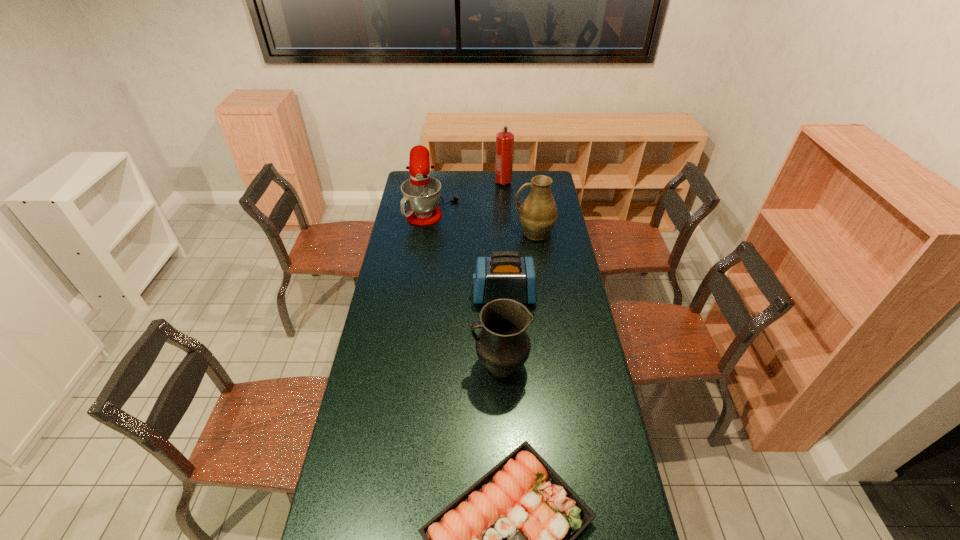
This screenshot has height=540, width=960. Identify the location of the third closest object to the mixer. (505, 274).

This screenshot has height=540, width=960. I want to click on vacant space that satisfies the following two spatial constraints: 1. on the handle side the fire extinguisher; 2. on the handle side of the second nearest object, so click(x=516, y=366).

Locate an element on the screen. free location that satisfies the following two spatial constraints: 1. on the handle side of the farther pitcher; 2. on the handle side the fire extinguisher is located at coordinates (527, 183).

This screenshot has height=540, width=960. Find the location of `free space that satisfies the following two spatial constraints: 1. on the handle side the fire extinguisher; 2. on the front-facing side of the fourth farthest object`. free space that satisfies the following two spatial constraints: 1. on the handle side the fire extinguisher; 2. on the front-facing side of the fourth farthest object is located at coordinates (512, 295).

Where is `vacant space that satisfies the following two spatial constraints: 1. on the handle side the fire extinguisher; 2. on the handle side of the farther pitcher`? vacant space that satisfies the following two spatial constraints: 1. on the handle side the fire extinguisher; 2. on the handle side of the farther pitcher is located at coordinates (507, 232).

Find the location of `free space that satisfies the following two spatial constraints: 1. on the bowl side of the mixer; 2. on the handle side of the farther pitcher`. free space that satisfies the following two spatial constraints: 1. on the bowl side of the mixer; 2. on the handle side of the farther pitcher is located at coordinates (429, 232).